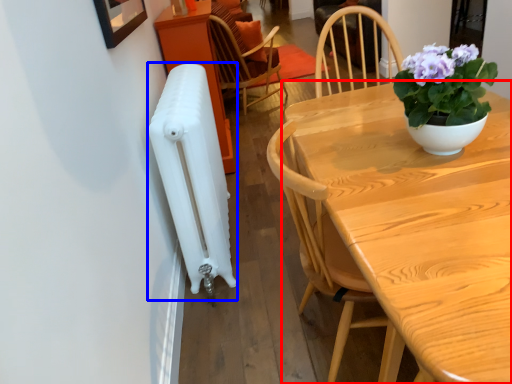
Question: Which object is closer to the camera taking this photo, table (highlighted by a red box) or radiator (highlighted by a blue box)?

Choices:
 (A) table
 (B) radiator

Answer: (A)